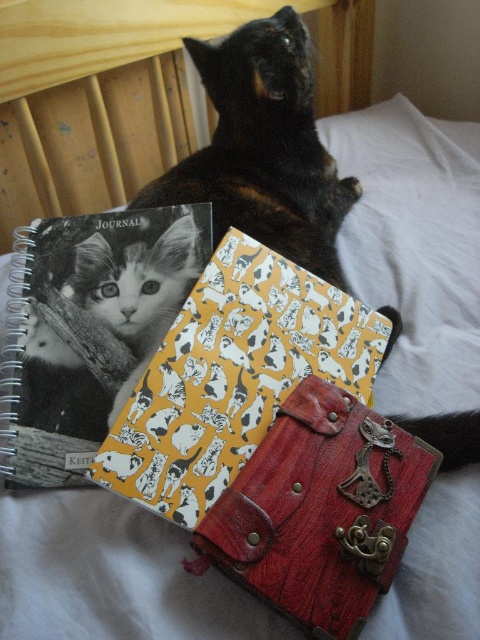
The width and height of the screenshot is (480, 640). In order to click on yellow paper with cat pattern at center in this screenshot , I will do (x=232, y=376).

Is yellow paper with cat pattern at center above white soft pillow at upper right?

No, yellow paper with cat pattern at center is not above white soft pillow at upper right.

Is point (257, 396) farther from camera compared to point (479, 236)?

No, (257, 396) is closer to viewer.

This screenshot has width=480, height=640. What are the coordinates of `yellow paper with cat pattern at center` in the screenshot? It's located at (232, 376).

Is point (168, 465) closer to camera compared to point (51, 348)?

Yes, it is in front of point (51, 348).

Who is lower down, yellow paper with cat pattern at center or black and white fur cat at center?

yellow paper with cat pattern at center is below.

Does point (153, 413) lie in front of point (133, 280)?

That is True.

This screenshot has height=640, width=480. What are the coordinates of `yellow paper with cat pattern at center` in the screenshot? It's located at 232,376.

Is white soft pillow at upper right positioned before black and white fur cat at center?

No, white soft pillow at upper right is further to the viewer.

Who is positioned more to the right, white soft pillow at upper right or black and white fur cat at center?

white soft pillow at upper right is more to the right.

Does point (355, 164) come farther from viewer compared to point (80, 436)?

Yes.

Find the location of a particular element. This screenshot has width=480, height=640. white soft pillow at upper right is located at coordinates (415, 248).